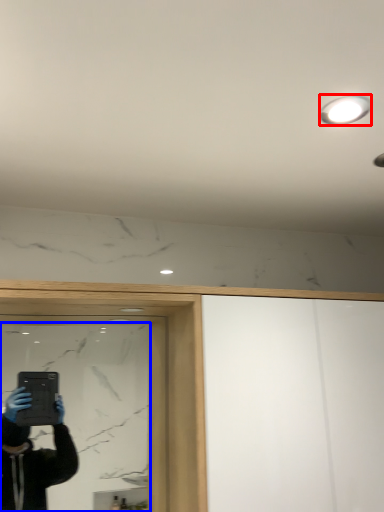
Question: Which object appears farthest to the camera in this image, light fixture (highlighted by a red box) or mirror (highlighted by a blue box)?

Choices:
 (A) light fixture
 (B) mirror

Answer: (B)